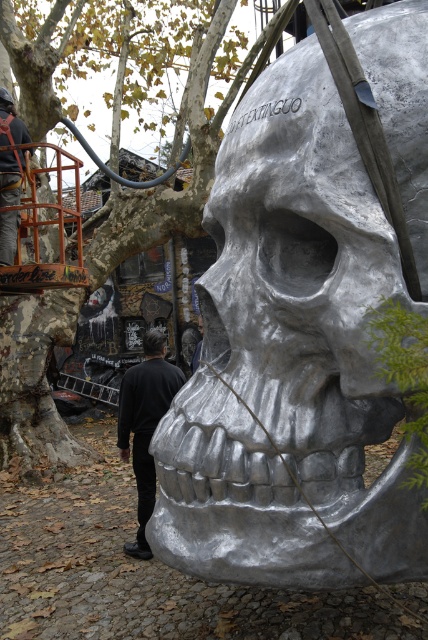
Question: Can you confirm if smooth bark tree at center is wider than black matte clothing at lower center?

Choices:
 (A) yes
 (B) no

Answer: (B)

Question: Which point is closer to the camera?

Choices:
 (A) black matte clothing at lower center
 (B) shiny silver skull at center
 (C) smooth bark tree at center

Answer: (B)

Question: Can you confirm if shiny silver skull at center is positioned to the left of black matte clothing at lower center?

Choices:
 (A) yes
 (B) no

Answer: (B)

Question: Which of the following is the closest to the observer?

Choices:
 (A) (273, 259)
 (B) (65, 296)
 (C) (166, 348)

Answer: (A)

Question: Does shiny silver skull at center have a larger size compared to black matte clothing at lower center?

Choices:
 (A) yes
 (B) no

Answer: (A)

Question: Among these objects, which one is farthest from the camera?

Choices:
 (A) shiny silver skull at center
 (B) black matte clothing at lower center

Answer: (B)